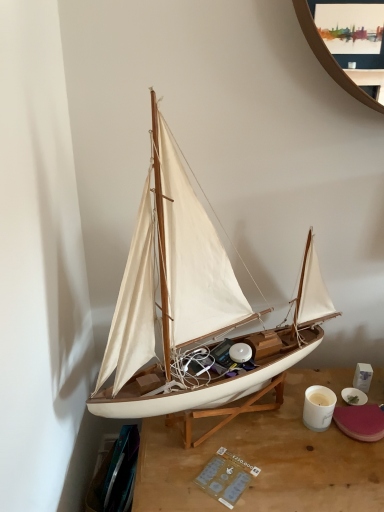
I want to click on free point above wooden desk at center (from a real-world perspective), so click(289, 437).